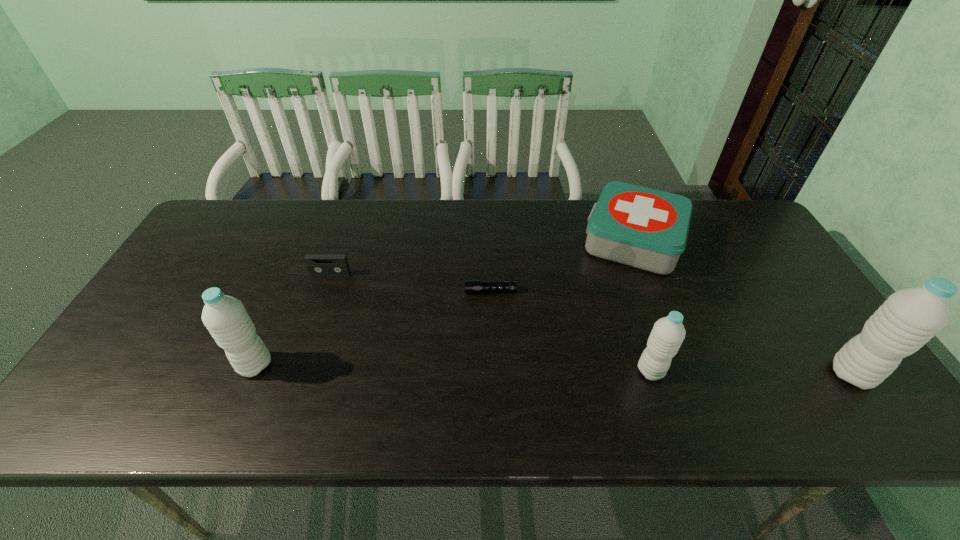
Find the location of `object at the right edge`. object at the right edge is located at coordinates (909, 318).

This screenshot has height=540, width=960. What are the coordinates of `object at the near right corner` in the screenshot? It's located at tap(909, 318).

The width and height of the screenshot is (960, 540). Identify the location of vacant region at the far edge. [390, 237].

You are a GUI agent. You are given a task and a screenshot of the screen. Output one action in this format:
    pyautogui.click(x=<x>, y=<y>)
    Task: Click on the vacant area at the near edge
    
    Given the screenshot: What is the action you would take?
    pyautogui.click(x=669, y=370)

Find the location of a particular element. The height and width of the screenshot is (540, 960). vacant space at the left edge of the desktop is located at coordinates (168, 318).

What are the coordinates of `vacant space at the far left corner` in the screenshot? It's located at (241, 206).

In the image, there is a desktop. Identify the location of vacant region at the near left corner. Image resolution: width=960 pixels, height=540 pixels. (110, 379).

I want to click on vacant space at the near right corner of the desktop, so click(x=814, y=373).

Locate an element on the screen. This screenshot has width=960, height=540. free space between the shortest water bottle and the videotape is located at coordinates (491, 322).

Find the location of a particular element. empty space between the rightmost water bottle and the fourth shortest object is located at coordinates (752, 373).